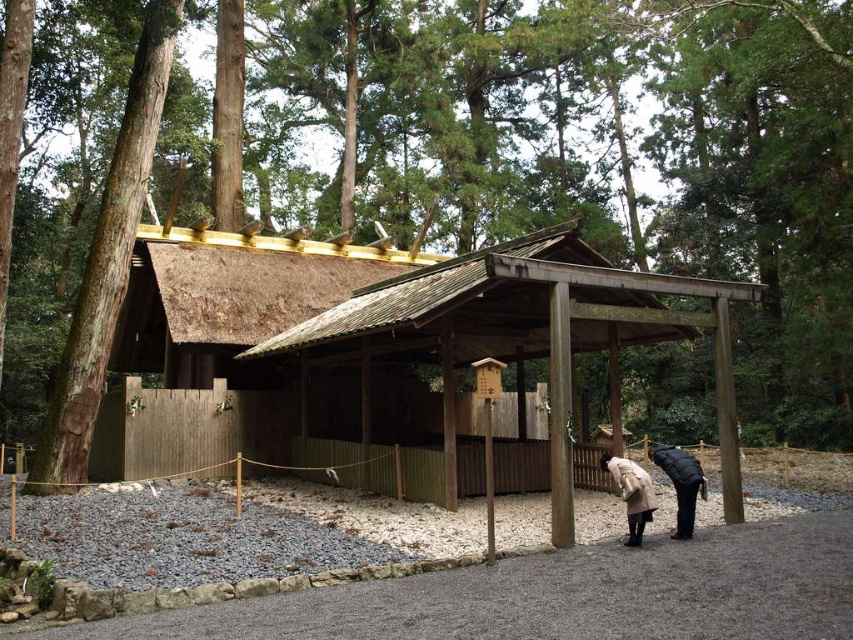
You are standing at the entrance of the shrine and want to take a photo of the point marked at coordinates point (683, 522). Your camera has a maximum focus range of 10 meters. Will the camera be able to focus on the point?

The distance of point (683, 522) from the camera is 10.03 meters, which exceeds the camera maximum focus range of 10 meters. The camera will not be able to focus on the point.

You are a visitor at the shrine and want to place both your black matte coat at lower right and beige wool coat at lower center on the gravel pathway. The pathway is only 1 meter wide. Which coat should you place closer to the stone wall to ensure both fit on the pathway?

Since the black matte coat at lower right might be wider than the beige wool coat at lower center, you should place the wider black matte coat at lower right closer to the stone wall to allow space for the narrower beige wool coat at lower center on the gravel pathway.